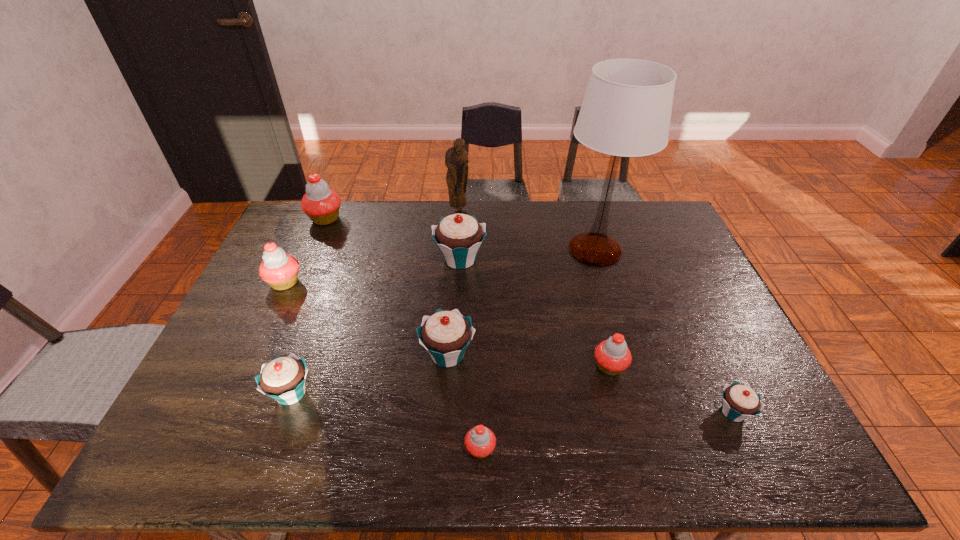
Locate an element on the screen. Image resolution: width=960 pixels, height=540 pixels. vacant space at the far edge is located at coordinates (424, 213).

In the image, there is a desktop. At what (x,y) coordinates should I click in order to perform the action: click on vacant space at the near edge. Please return your answer as a coordinate pair (x, y). This screenshot has height=540, width=960. Looking at the image, I should click on (319, 465).

I want to click on free point at the left edge, so click(212, 386).

In the image, there is a desktop. In order to click on blank space at the right edge in this screenshot , I will do `click(743, 428)`.

You are a GUI agent. You are given a task and a screenshot of the screen. Output one action in this format:
    pyautogui.click(x=<x>, y=<y>)
    Task: Click on the vacant area at the far left corner
    
    Given the screenshot: What is the action you would take?
    pyautogui.click(x=292, y=221)

This screenshot has height=540, width=960. In order to click on free space between the rightmost teal cupcake and the third biggest red cupcake in this screenshot , I will do `click(671, 389)`.

The width and height of the screenshot is (960, 540). Identify the location of empty location between the third nearest red cupcake and the second smallest teal cupcake. (288, 338).

This screenshot has width=960, height=540. I want to click on blank region between the table lamp and the farthest teal cupcake, so pos(527,254).

Locate an element on the screen. The image size is (960, 540). free space that is in between the rightmost teal cupcake and the nearest red cupcake is located at coordinates (607, 430).

This screenshot has height=540, width=960. I want to click on empty location between the rightmost teal cupcake and the table lamp, so click(x=663, y=331).